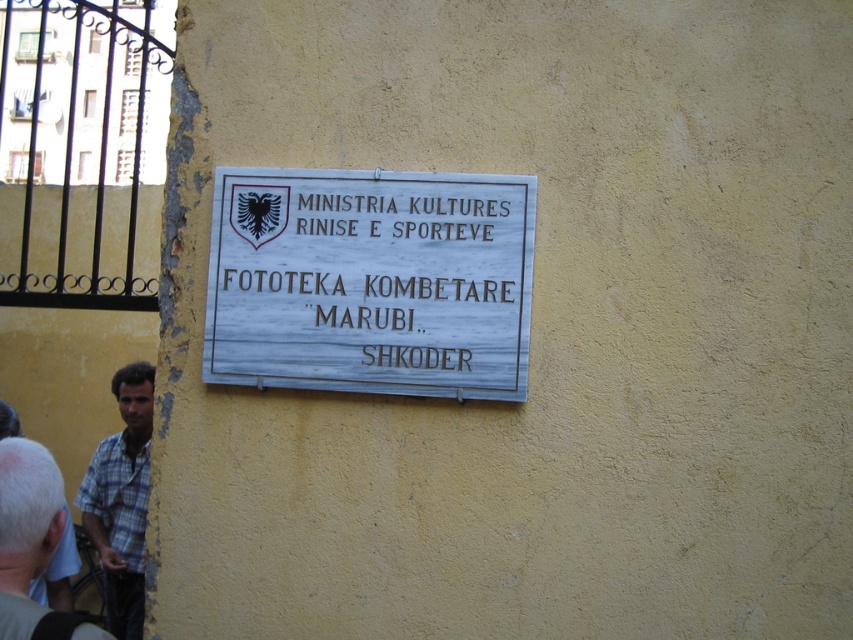
How much distance is there between white wooden sign at center and plaid shirt at lower left?

The distance of white wooden sign at center from plaid shirt at lower left is 2.06 meters.

Can you confirm if white wooden sign at center is positioned to the right of plaid shirt at lower left?

Correct, you'll find white wooden sign at center to the right of plaid shirt at lower left.

Which is in front, point (303, 384) or point (119, 528)?

Point (303, 384) is more forward.

You are a GUI agent. You are given a task and a screenshot of the screen. Output one action in this format:
    pyautogui.click(x=<x>, y=<y>)
    Task: Click on the white wooden sign at center
    Image resolution: width=853 pixels, height=640 pixels.
    Given the screenshot: What is the action you would take?
    pyautogui.click(x=370, y=282)

Who is positioned more to the right, white wooden sign at center or plaid fabric shirt at lower left?

white wooden sign at center

Is point (254, 355) in front of point (57, 493)?

No, it is not.

Between point (235, 284) and point (22, 525), which one is positioned behind?

Point (235, 284)

I want to click on white wooden sign at center, so [370, 282].

Does plaid shirt at lower left lie in front of plaid fabric shirt at lower left?

No, plaid shirt at lower left is further to the viewer.

Between point (114, 388) and point (26, 586), which one is positioned in front?

Point (26, 586) is in front.

Identify the location of plaid shirt at lower left. This screenshot has height=640, width=853. (120, 500).